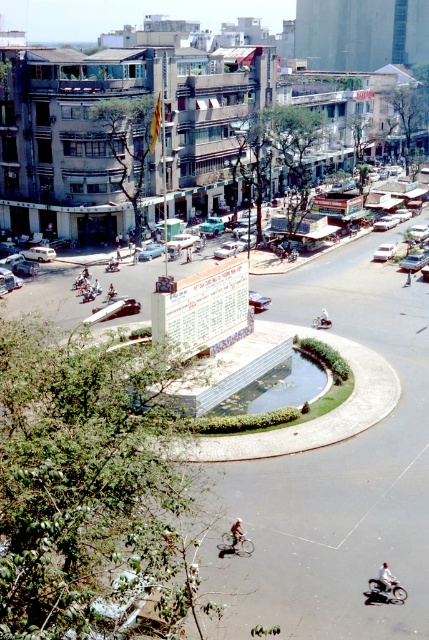
Question: Which object appears closest to the camera in this image?

Choices:
 (A) white matte motorcycle at center
 (B) white glossy car at center
 (C) shiny silver motorcycle at center

Answer: (C)

Question: Is silver metallic bicycle at center closer to camera compared to white matte motorcycle at center?

Choices:
 (A) yes
 (B) no

Answer: (B)

Question: Which object is farther from the camera taking this photo?

Choices:
 (A) silver metallic bicycle at center
 (B) white matte motorcycle at center

Answer: (A)

Question: In this image, where is white glossy car at center located relative to light brown leather jacket at center?

Choices:
 (A) left
 (B) right

Answer: (B)

Question: Is shiny silver motorcycle at center below white matte motorcycle at center?

Choices:
 (A) no
 (B) yes

Answer: (B)

Question: Which object is the closest to the metallic silver motorcycle at center?

Choices:
 (A) white glossy car at center
 (B) white matte motorcycle at center
 (C) metallic silver car at center
 (D) light brown leather jacket at center

Answer: (C)